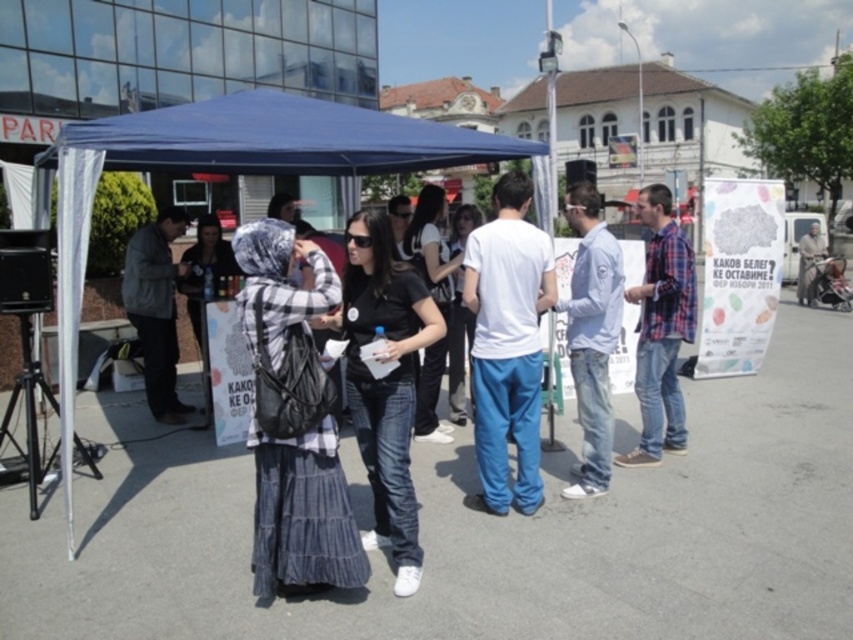
You are standing at the entrance of the canopy tent and want to locate the plaid fabric headscarf at center. Which direction should you look to find it?

The plaid fabric headscarf at center is located at point (302, 515), so you should look towards the lower right direction from your position at the entrance.

Based on the photo, you are standing at the center of the event area and want to hand a pamphlet to the person wearing the dark gray jacket at left and the light brown fabric coat at lower right. Which one is closer to you?

The dark gray jacket at left is 13.16 meters away from light brown fabric coat at lower right, so the light brown fabric coat at lower right is closer to you since it is at lower right compared to the dark gray jacket at left.